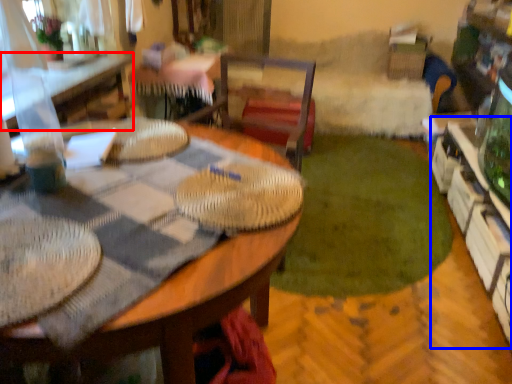
Question: Which of the following is the closest to the observer, table (highlighted by a red box) or shelf (highlighted by a blue box)?

Choices:
 (A) table
 (B) shelf

Answer: (B)